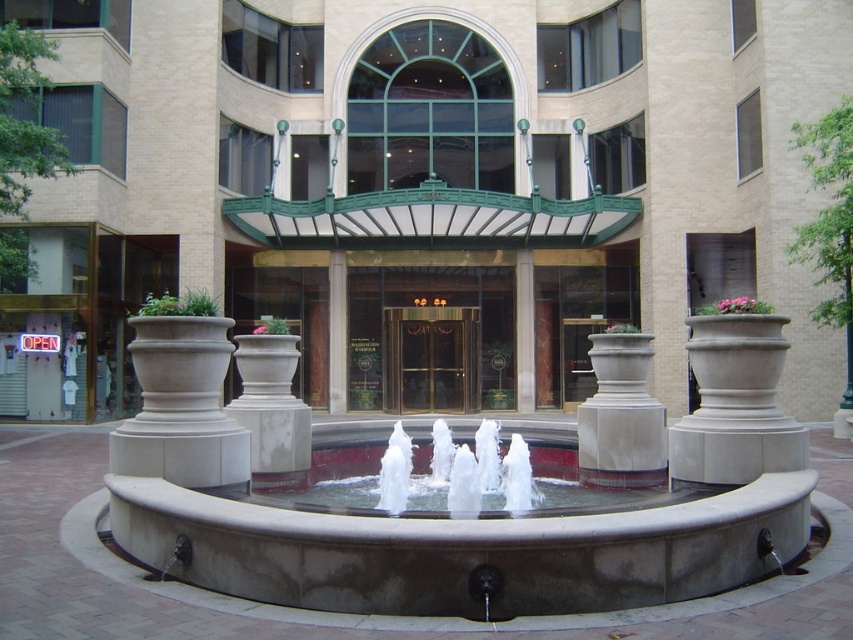
Between gold/glass revolving door at center and white concrete planter at center, which one has less height?

gold/glass revolving door at center is shorter.

Can you confirm if gold/glass revolving door at center is smaller than white concrete planter at center?

Yes, gold/glass revolving door at center is smaller than white concrete planter at center.

Who is more distant from viewer, (383,397) or (730,273)?

The point (730,273) is behind.

I want to click on gold/glass revolving door at center, so click(x=430, y=339).

Can you confirm if smooth concrete fountain at center is positioned above gold/glass revolving door at center?

No, smooth concrete fountain at center is not above gold/glass revolving door at center.

Where is `smooth concrete fountain at center`? The width and height of the screenshot is (853, 640). smooth concrete fountain at center is located at coordinates (442, 518).

Is point (708, 544) positioned after point (746, 234)?

No, (708, 544) is closer to viewer.

Locate an element on the screen. smooth concrete fountain at center is located at coordinates (442, 518).

This screenshot has height=640, width=853. Find the location of `smooth concrete fountain at center`. smooth concrete fountain at center is located at coordinates (442, 518).